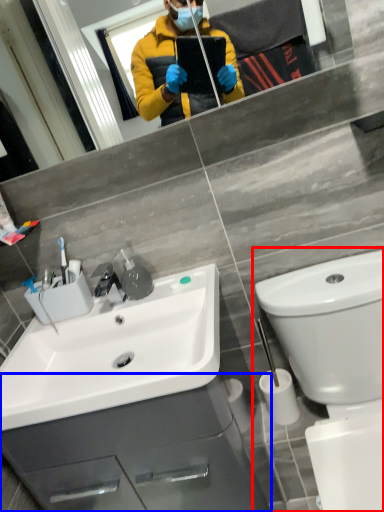
Question: Which object appears closest to the camera in this image, toilet (highlighted by a red box) or bathroom cabinet (highlighted by a blue box)?

Choices:
 (A) toilet
 (B) bathroom cabinet

Answer: (A)